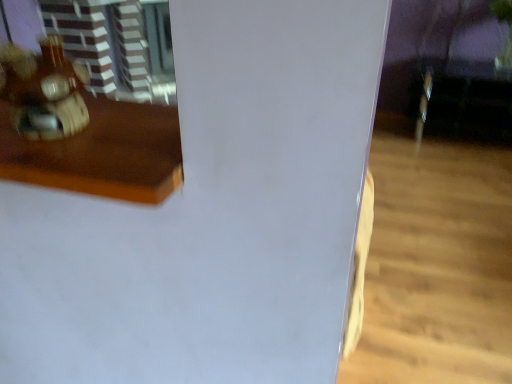
Question: Is point (71, 64) closer or farther from the camera than point (37, 145)?

Choices:
 (A) closer
 (B) farther

Answer: (A)

Question: From the image's perspective, is wooden toy at left above or below wooden table at left?

Choices:
 (A) above
 (B) below

Answer: (A)

Question: Based on their positions, is wooden toy at left located to the left or right of wooden table at left?

Choices:
 (A) right
 (B) left

Answer: (B)

Question: Relative to wooden toy at left, is wooden table at left in front or behind?

Choices:
 (A) front
 (B) behind

Answer: (A)

Question: Looking at their shapes, would you say wooden table at left is wider or thinner than wooden toy at left?

Choices:
 (A) wide
 (B) thin

Answer: (A)

Question: Is wooden table at left spatially inside wooden toy at left, or outside of it?

Choices:
 (A) inside
 (B) outside

Answer: (B)

Question: Considering the positions of wooden table at left and wooden toy at left in the image, is wooden table at left taller or shorter than wooden toy at left?

Choices:
 (A) tall
 (B) short

Answer: (B)